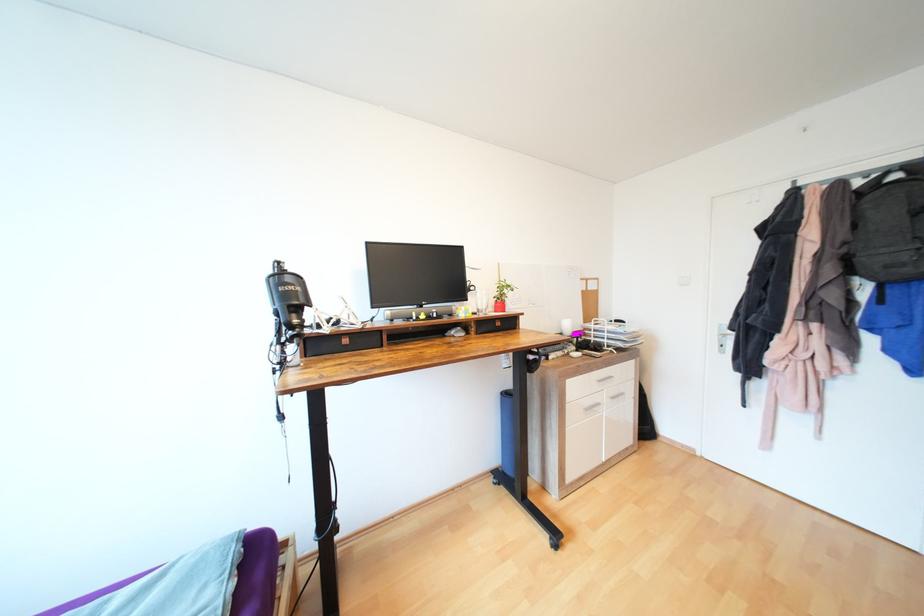
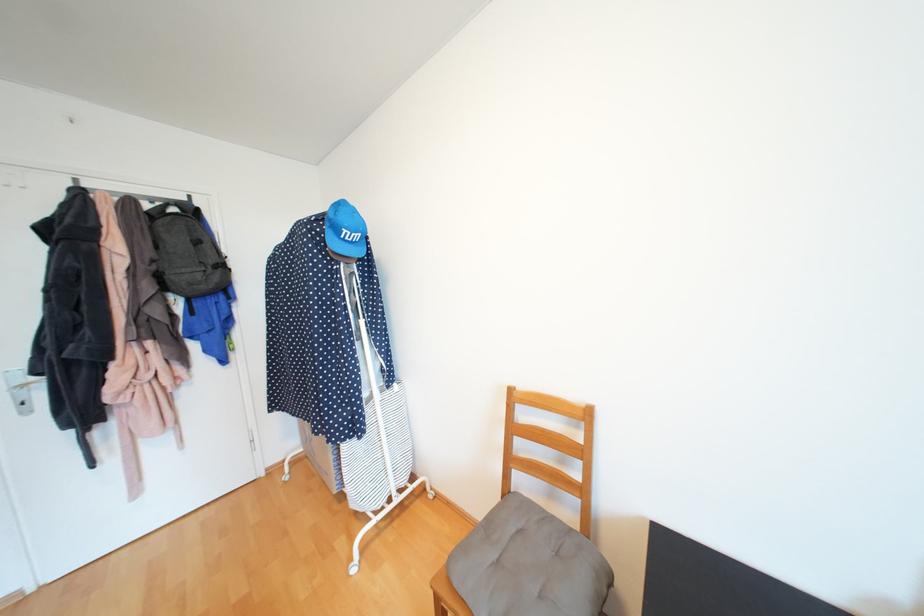
In the second image, find the point that corresponds to [850,244] in the first image.

(160, 262)